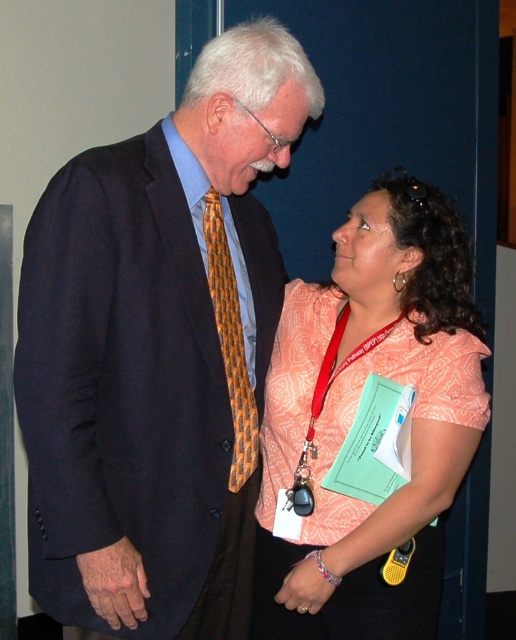
Question: Which object appears farthest from the camera in this image?

Choices:
 (A) patterned fabric blouse at center
 (B) orange woven tie at center
 (C) matte black suit at left

Answer: (A)

Question: Does patterned fabric blouse at center appear over orange woven tie at center?

Choices:
 (A) no
 (B) yes

Answer: (A)

Question: Is patterned fabric blouse at center closer to camera compared to orange woven tie at center?

Choices:
 (A) no
 (B) yes

Answer: (A)

Question: Is matte black suit at left bigger than patterned fabric blouse at center?

Choices:
 (A) no
 (B) yes

Answer: (B)

Question: Which point is farther to the camera?

Choices:
 (A) (147, 298)
 (B) (379, 189)
 (C) (238, 460)

Answer: (B)

Question: Based on their relative distances, which object is nearer to the matte black suit at left?

Choices:
 (A) orange woven tie at center
 (B) patterned fabric blouse at center

Answer: (A)